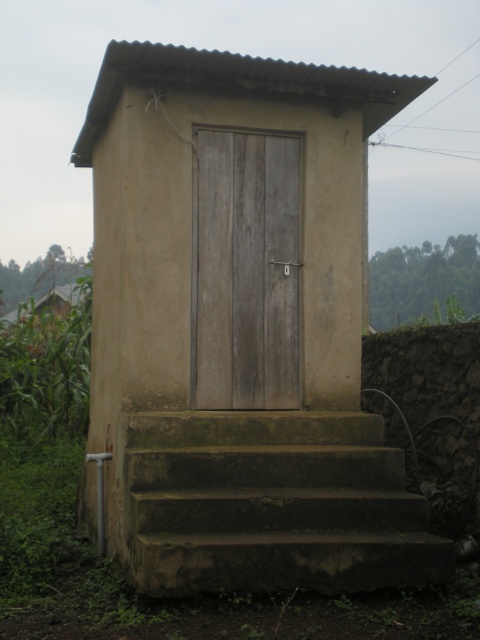
Question: Estimate the real-world distances between objects in this image. Which object is farther from the weathered wood door at center?

Choices:
 (A) green mossy concrete stairs at lower center
 (B) brown matte door at center

Answer: (A)

Question: Can you confirm if brown matte door at center is positioned to the left of green mossy concrete stairs at lower center?

Choices:
 (A) no
 (B) yes

Answer: (B)

Question: Is brown matte door at center positioned before green mossy concrete stairs at lower center?

Choices:
 (A) yes
 (B) no

Answer: (B)

Question: Which point appears farthest from the camera in this image?

Choices:
 (A) (445, 566)
 (B) (144, 216)

Answer: (B)

Question: From the image, what is the correct spatial relationship of green mossy concrete stairs at lower center in relation to weathered wood door at center?

Choices:
 (A) below
 (B) above

Answer: (A)

Question: Which object is positioned farthest from the weathered wood door at center?

Choices:
 (A) brown matte door at center
 (B) green mossy concrete stairs at lower center

Answer: (B)